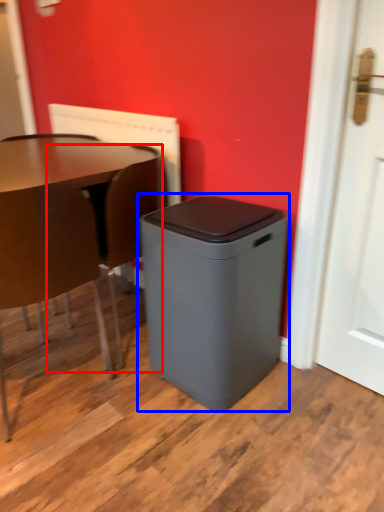
Question: Which point is closer to the camera, swivel chair (highlighted by a red box) or waste container (highlighted by a blue box)?

Choices:
 (A) swivel chair
 (B) waste container

Answer: (B)